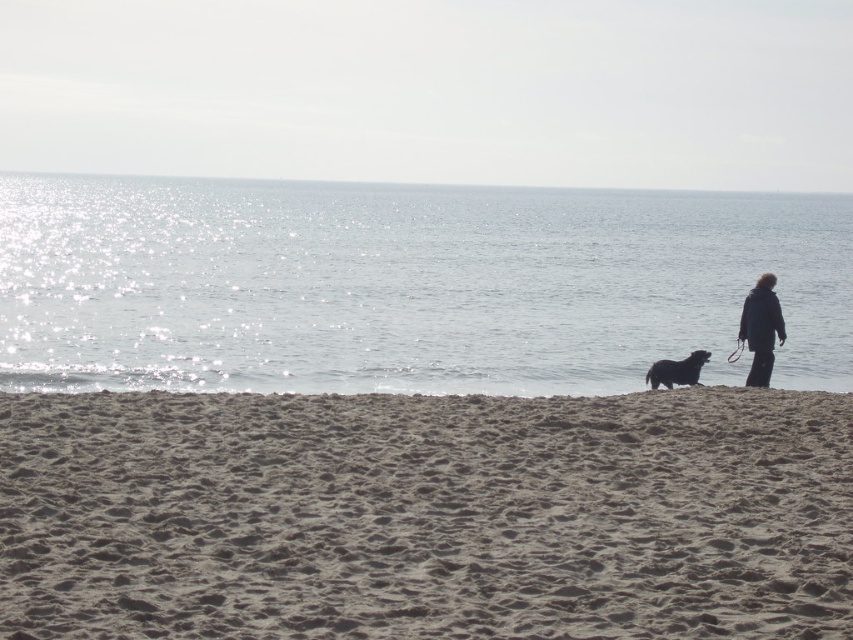
Question: Which point appears closest to the camera in this image?

Choices:
 (A) (686, 362)
 (B) (744, 385)

Answer: (B)

Question: Which point is farther to the camera?

Choices:
 (A) coord(378,499)
 (B) coord(357,269)
 (C) coord(781,333)
 (D) coord(679,362)

Answer: (B)

Question: Can you confirm if brown sandy beach at lower center is positioned below sparkling water at center?

Choices:
 (A) yes
 (B) no

Answer: (A)

Question: Which object is farther from the camera taking this photo?

Choices:
 (A) dark blue jacket at right
 (B) brown sandy beach at lower center
 (C) dark brown fur dog at lower right

Answer: (C)

Question: Can you confirm if sparkling water at center is smaller than dark blue jacket at right?

Choices:
 (A) yes
 (B) no

Answer: (B)

Question: Can you confirm if brown sandy beach at lower center is thinner than dark blue jacket at right?

Choices:
 (A) no
 (B) yes

Answer: (B)